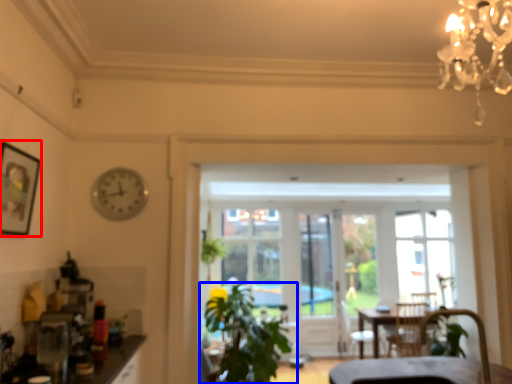
Question: Which point is further to the camera, picture frame (highlighted by a red box) or houseplant (highlighted by a blue box)?

Choices:
 (A) picture frame
 (B) houseplant

Answer: (B)